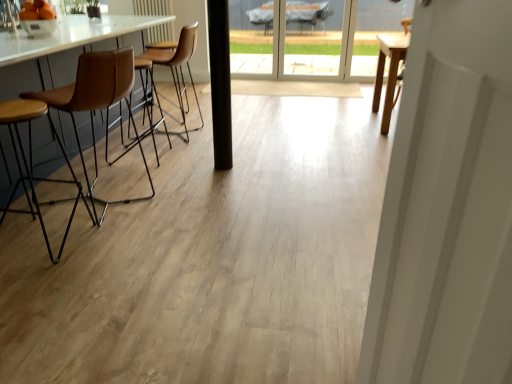
Question: From a real-world perspective, is brown leather stool at left, placed as the second chair when sorted from back to front, above or below brown leather chair at left, which is the 1th chair from back to front?

Choices:
 (A) below
 (B) above

Answer: (A)

Question: Is brown leather stool at left, placed as the second chair when sorted from back to front, wider or thinner than brown leather chair at left, which is the 1th chair from back to front?

Choices:
 (A) wide
 (B) thin

Answer: (B)

Question: Based on their relative distances, which object is nearer to the brown leather chair at left, which is the 1th chair from back to front?

Choices:
 (A) brown leather stool at left, placed as the second chair when sorted from back to front
 (B) transparent glass screen door at upper center
 (C) brown leather stool at left, which ranks as the 3th chair in back-to-front order

Answer: (A)

Question: Which object is the farthest from the brown leather stool at left, positioned as the second chair in front-to-back order?

Choices:
 (A) brown leather stool at left, which ranks as the 3th chair in back-to-front order
 (B) brown leather chair at left, marked as the 3th chair in a front-to-back arrangement
 (C) transparent glass screen door at upper center

Answer: (C)